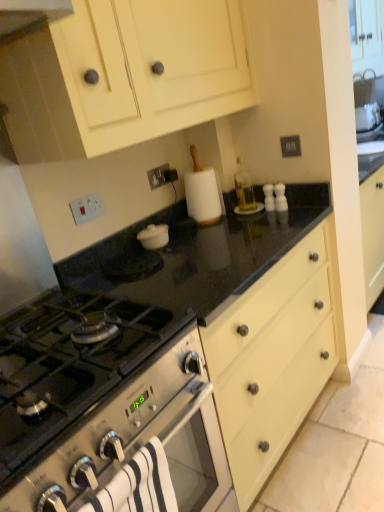
Question: Is matte cream cabinet at upper center at the back of black granite countertop at center?

Choices:
 (A) yes
 (B) no

Answer: (B)

Question: Can you confirm if black granite countertop at center is smaller than matte cream cabinet at upper center?

Choices:
 (A) yes
 (B) no

Answer: (B)

Question: Can matte cream cabinet at upper center be found inside black granite countertop at center?

Choices:
 (A) no
 (B) yes

Answer: (A)

Question: Is black granite countertop at center to the left of matte cream cabinet at upper center from the viewer's perspective?

Choices:
 (A) no
 (B) yes

Answer: (A)

Question: From a real-world perspective, is black granite countertop at center located beneath matte cream cabinet at upper center?

Choices:
 (A) yes
 (B) no

Answer: (A)

Question: Considering their positions, is stainless steel gas stove at lower left located in front of or behind matte cream cabinet at upper center?

Choices:
 (A) front
 (B) behind

Answer: (A)

Question: Looking at their shapes, would you say stainless steel gas stove at lower left is wider or thinner than matte cream cabinet at upper center?

Choices:
 (A) thin
 (B) wide

Answer: (B)

Question: Is stainless steel gas stove at lower left spatially inside matte cream cabinet at upper center, or outside of it?

Choices:
 (A) outside
 (B) inside

Answer: (A)

Question: Considering the positions of point (59, 381) and point (165, 60), is point (59, 381) closer or farther from the camera than point (165, 60)?

Choices:
 (A) closer
 (B) farther

Answer: (A)

Question: Is white striped towel at lower left to the left or to the right of matte cream cabinet at upper center in the image?

Choices:
 (A) right
 (B) left

Answer: (A)

Question: Is white striped towel at lower left in front of or behind matte cream cabinet at upper center in the image?

Choices:
 (A) front
 (B) behind

Answer: (A)

Question: In terms of height, does white striped towel at lower left look taller or shorter compared to matte cream cabinet at upper center?

Choices:
 (A) tall
 (B) short

Answer: (B)

Question: Which is correct: white striped towel at lower left is inside matte cream cabinet at upper center, or outside of it?

Choices:
 (A) inside
 (B) outside

Answer: (B)

Question: Considering the positions of white striped towel at lower left and black granite countertop at center in the image, is white striped towel at lower left taller or shorter than black granite countertop at center?

Choices:
 (A) short
 (B) tall

Answer: (A)

Question: Is point (157, 501) closer or farther from the camera than point (276, 278)?

Choices:
 (A) farther
 (B) closer

Answer: (B)